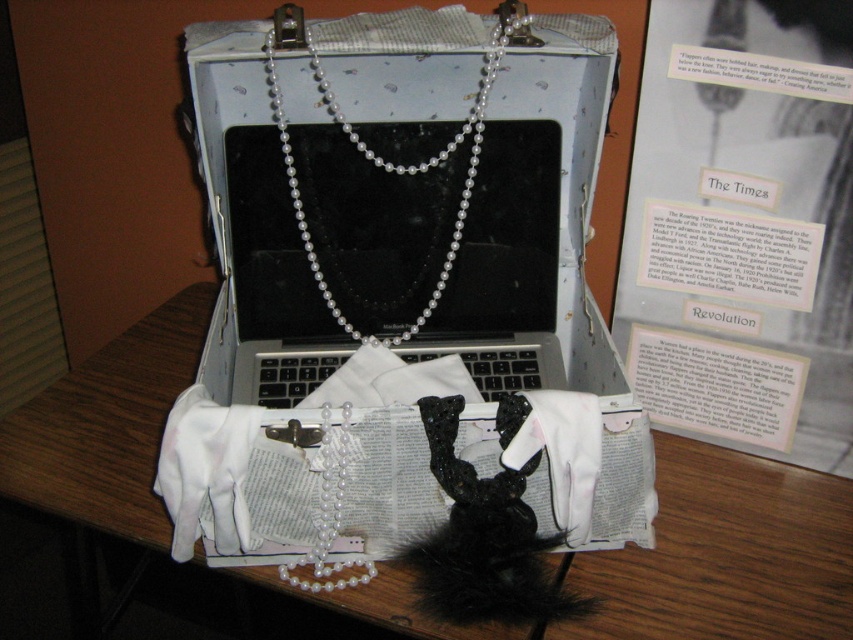
Is wooden table at center smaller than pearl necklace at center?

No.

Which is in front, point (630, 556) or point (448, 259)?

Point (630, 556)

Identify the location of wooden table at center. Image resolution: width=853 pixels, height=640 pixels. (728, 554).

Who is taller, white fabric purse at center or pearl necklace at center?

Standing taller between the two is pearl necklace at center.

Which is behind, point (293, 417) or point (372, 154)?

The point (372, 154) is more distant.

In order to click on white fabric purse at center in this screenshot , I will do `click(294, 483)`.

Which is behind, point (630, 600) or point (355, 422)?

The point (630, 600) is behind.

Image resolution: width=853 pixels, height=640 pixels. In order to click on wooden table at center in this screenshot , I will do `click(728, 554)`.